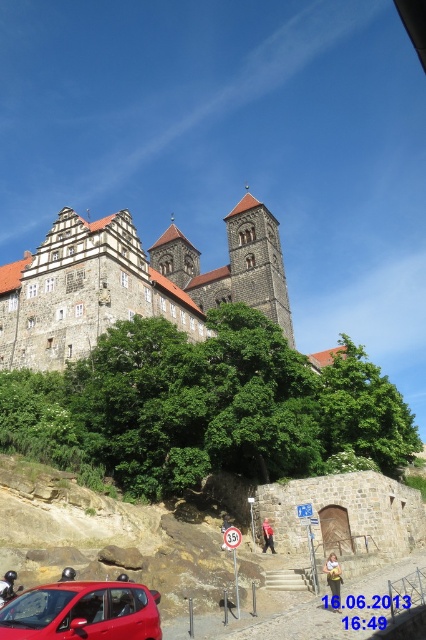
You are a tourist visiting the historic site and want to take a photo of the brown stone tower at center without the shiny red car at lower left blocking the view. Where should you position yourself relative to the car?

To avoid the shiny red car at lower left blocking the view of the brown stone tower at center, you should position yourself to the right of the car since the car is to the left of the tower.

In the scene shown: You are a tourist standing at the base of the hill looking up at the stone castle at upper center and the brown stone tower at center. Which structure is closer to you?

The stone castle at upper center is closer to you because it is positioned in front of the brown stone tower at center.